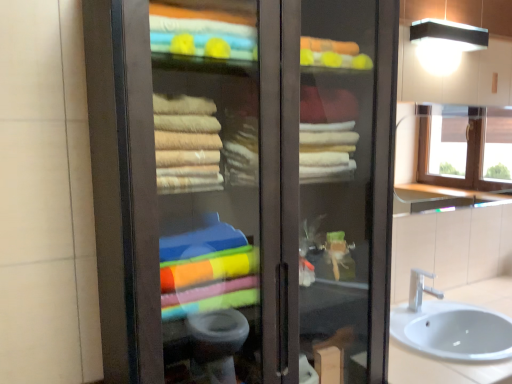
This screenshot has height=384, width=512. What do you see at coordinates (465, 147) in the screenshot?
I see `clear glass window at upper right` at bounding box center [465, 147].

Image resolution: width=512 pixels, height=384 pixels. Describe the element at coordinates (420, 289) in the screenshot. I see `silver metallic faucet at lower right` at that location.

At what (x,y) coordinates should I click in order to perform the action: click on black matte light fixture at upper right. Please return your answer as a coordinate pair (x, y). Image resolution: width=512 pixels, height=384 pixels. Looking at the image, I should click on (448, 35).

What is the approximate width of matte glass cabinet at center?

The width of matte glass cabinet at center is 15.63 inches.

Where is `clear glass window at upper right`? clear glass window at upper right is located at coordinates (465, 147).

Does clear glass window at upper right appear on the right side of silver metallic faucet at lower right?

Indeed, clear glass window at upper right is positioned on the right side of silver metallic faucet at lower right.

Between clear glass window at upper right and silver metallic faucet at lower right, which one has larger width?

Wider between the two is silver metallic faucet at lower right.

At what (x,y) coordinates should I click in order to perform the action: click on tap on the left of clear glass window at upper right. Please return your answer as a coordinate pair (x, y). Looking at the image, I should click on (420, 289).

How distant is clear glass window at upper right from silver metallic faucet at lower right?

1.97 meters.

From the image's perspective, is clear glass window at upper right above matte glass cabinet at center?

Yes, from the image's perspective, clear glass window at upper right is above matte glass cabinet at center.

Which of these two, clear glass window at upper right or matte glass cabinet at center, stands shorter?

clear glass window at upper right.

Is clear glass window at upper right with matte glass cabinet at center?

No, clear glass window at upper right is not touching matte glass cabinet at center.

Based on the photo, in terms of width, does black matte light fixture at upper right look wider or thinner when compared to clear glass window at upper right?

black matte light fixture at upper right is wider than clear glass window at upper right.

Is black matte light fixture at upper right situated inside clear glass window at upper right or outside?

black matte light fixture at upper right is not enclosed by clear glass window at upper right.

From a real-world perspective, is black matte light fixture at upper right physically located above or below clear glass window at upper right?

black matte light fixture at upper right is situated higher than clear glass window at upper right in the real world.

What's the angular difference between black matte light fixture at upper right and clear glass window at upper right's facing directions?

The angular difference between black matte light fixture at upper right and clear glass window at upper right is 0.352 degrees.

Between matte glass cabinet at center and clear glass window at upper right, which one has smaller width?

clear glass window at upper right is thinner.

Does matte glass cabinet at center lie in front of clear glass window at upper right?

Yes, it is in front of clear glass window at upper right.

Would you consider matte glass cabinet at center to be distant from clear glass window at upper right?

Yes, matte glass cabinet at center and clear glass window at upper right are quite far apart.

Consider the image. Considering the sizes of objects silver metallic faucet at lower right and black matte light fixture at upper right in the image provided, who is thinner, silver metallic faucet at lower right or black matte light fixture at upper right?

black matte light fixture at upper right is thinner.

From the image's perspective, between silver metallic faucet at lower right and black matte light fixture at upper right, which one is located above?

black matte light fixture at upper right, from the image's perspective.

Is silver metallic faucet at lower right bigger or smaller than black matte light fixture at upper right?

Clearly, silver metallic faucet at lower right is smaller in size than black matte light fixture at upper right.

Is point (419, 282) positioned after point (421, 28)?

Yes, point (419, 282) is behind point (421, 28).

Who is smaller, black matte light fixture at upper right or white ceramic sink at lower right?

black matte light fixture at upper right.

Is black matte light fixture at upper right in contact with white ceramic sink at lower right?

There is a gap between black matte light fixture at upper right and white ceramic sink at lower right.

Is the depth of black matte light fixture at upper right less than that of white ceramic sink at lower right?

No, the depth of black matte light fixture at upper right is greater than that of white ceramic sink at lower right.

Who is shorter, black matte light fixture at upper right or white ceramic sink at lower right?

black matte light fixture at upper right.

Is white ceramic sink at lower right completely or partially outside of matte glass cabinet at center?

Absolutely, white ceramic sink at lower right is external to matte glass cabinet at center.

Who is bigger, white ceramic sink at lower right or matte glass cabinet at center?

matte glass cabinet at center is bigger.

From their relative heights in the image, would you say white ceramic sink at lower right is taller or shorter than matte glass cabinet at center?

Considering their sizes, white ceramic sink at lower right has less height than matte glass cabinet at center.

Considering the points (414, 271) and (219, 135), which point is behind, point (414, 271) or point (219, 135)?

The point (414, 271) is farther from the camera.

Locate an element on the screen. window that appears behind the silver metallic faucet at lower right is located at coordinates (465, 147).

Image resolution: width=512 pixels, height=384 pixels. In order to click on bathroom cabinet below the clear glass window at upper right (from the image's perspective) in this screenshot , I will do `click(241, 185)`.

Based on their spatial positions, is matte glass cabinet at center or white ceramic sink at lower right further from clear glass window at upper right?

matte glass cabinet at center is positioned further to the anchor clear glass window at upper right.

Looking at the image, which one is located closer to silver metallic faucet at lower right, clear glass window at upper right or matte glass cabinet at center?

matte glass cabinet at center.

Looking at the image, which one is located closer to black matte light fixture at upper right, matte glass cabinet at center or clear glass window at upper right?

matte glass cabinet at center is positioned closer to the anchor black matte light fixture at upper right.

Estimate the real-world distances between objects in this image. Which object is closer to matte glass cabinet at center, clear glass window at upper right or white ceramic sink at lower right?

white ceramic sink at lower right is closer to matte glass cabinet at center.

From the image, which object appears to be farther from white ceramic sink at lower right, matte glass cabinet at center or black matte light fixture at upper right?

The object further to white ceramic sink at lower right is black matte light fixture at upper right.

When comparing their distances from black matte light fixture at upper right, does white ceramic sink at lower right or matte glass cabinet at center seem further?

white ceramic sink at lower right lies further to black matte light fixture at upper right than the other object.

Considering their positions, is clear glass window at upper right positioned further to white ceramic sink at lower right than silver metallic faucet at lower right?

clear glass window at upper right is further to white ceramic sink at lower right.

From the image, which object appears to be farther from white ceramic sink at lower right, silver metallic faucet at lower right or clear glass window at upper right?

clear glass window at upper right is further to white ceramic sink at lower right.

This screenshot has width=512, height=384. I want to click on sink between matte glass cabinet at center and silver metallic faucet at lower right from front to back, so click(x=450, y=326).

Locate an element on the screen. This screenshot has width=512, height=384. window between black matte light fixture at upper right and white ceramic sink at lower right in the up-down direction is located at coordinates (465, 147).

Locate an element on the screen. The image size is (512, 384). tap between clear glass window at upper right and white ceramic sink at lower right vertically is located at coordinates (420, 289).

I want to click on tap between black matte light fixture at upper right and white ceramic sink at lower right from top to bottom, so [420, 289].